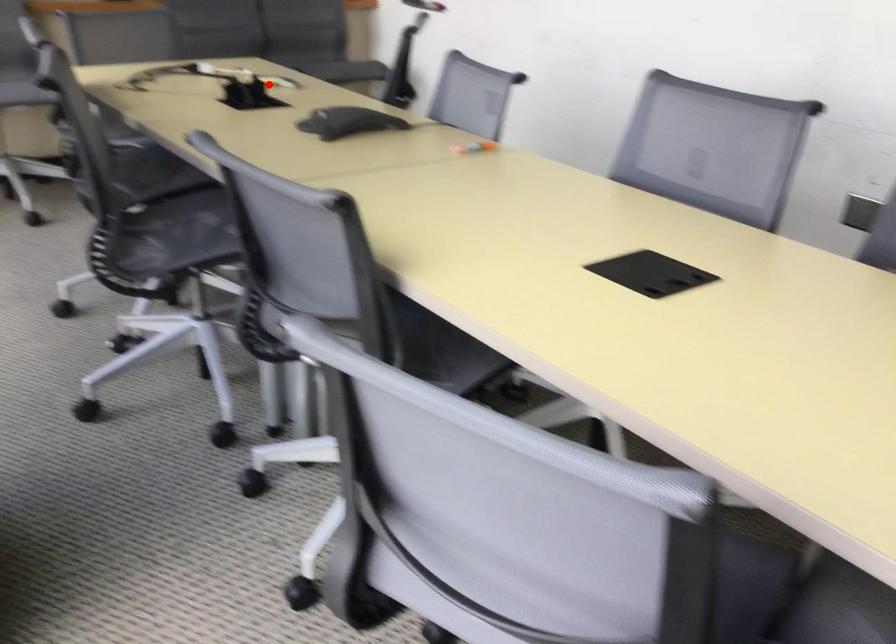
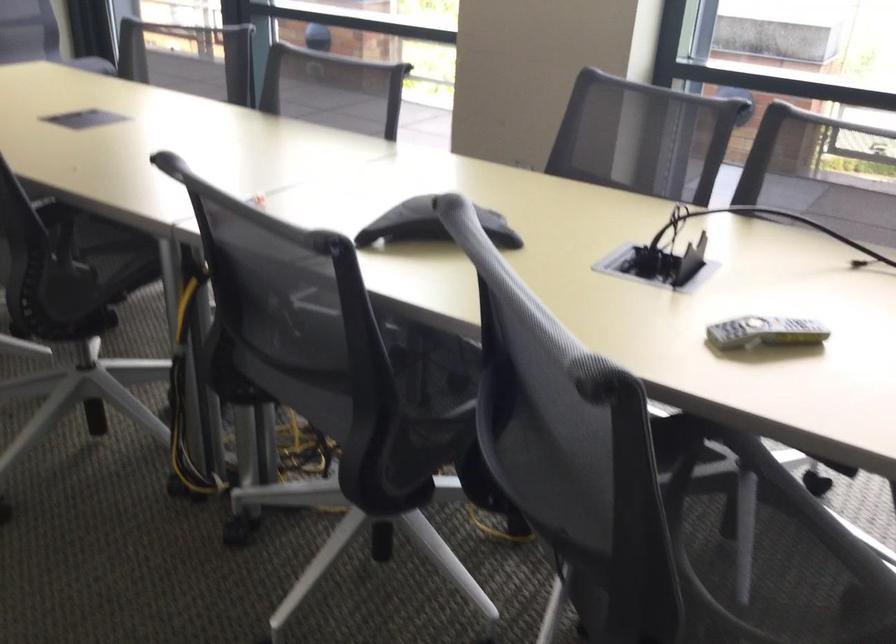
Question: I am providing you with two images of the same scene from different viewpoints. Image1 has a red point marked. In image2, the corresponding 3D location appears at what relative position? Reply with the corresponding letter.

Choices:
 (A) Closer
 (B) Farther

Answer: (A)